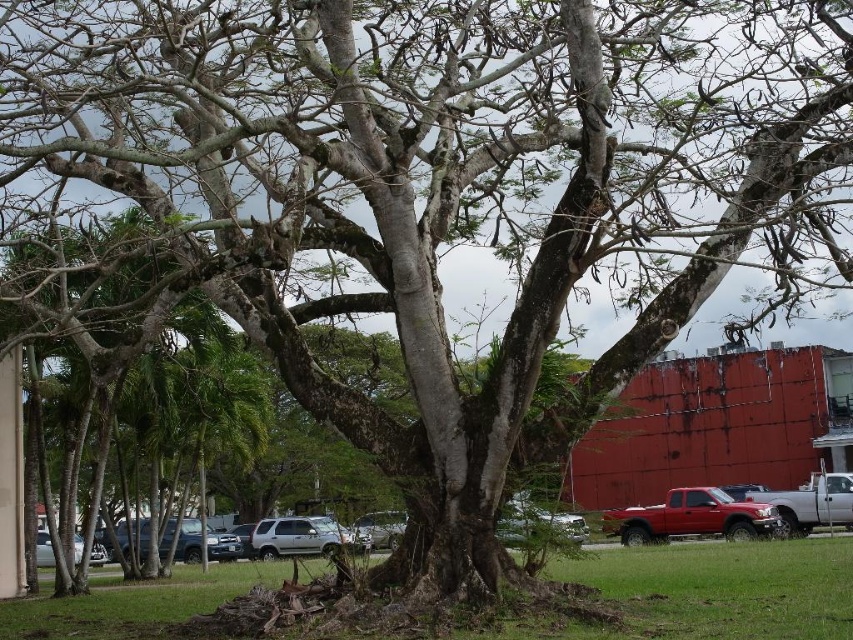
Is point (699, 561) less distant than point (107, 557)?

Yes, it is in front of point (107, 557).

Who is higher up, green grass at center or silver metallic car at lower left?

green grass at center is above.

Does point (627, 598) come closer to viewer compared to point (39, 548)?

Yes, point (627, 598) is closer to viewer.

You are a GUI agent. You are given a task and a screenshot of the screen. Output one action in this format:
    pyautogui.click(x=<x>, y=<y>)
    Task: Click on the green grass at center
    This screenshot has width=853, height=640.
    Given the screenshot: What is the action you would take?
    pyautogui.click(x=708, y=593)

Who is taller, silver metallic suv at center or satin silver sedan at lower center?

silver metallic suv at center

Is silver metallic suv at center in front of satin silver sedan at lower center?

No, it is behind satin silver sedan at lower center.

Looking at this image, who is more forward, (x=259, y=525) or (x=395, y=520)?

Positioned in front is point (x=395, y=520).

I want to click on silver metallic suv at center, so click(x=302, y=538).

Can you confirm if green grass at center is wider than silver metallic suv at center?

Yes.

Describe the element at coordinates (708, 593) in the screenshot. This screenshot has width=853, height=640. I see `green grass at center` at that location.

Find the location of a particular element. green grass at center is located at coordinates (708, 593).